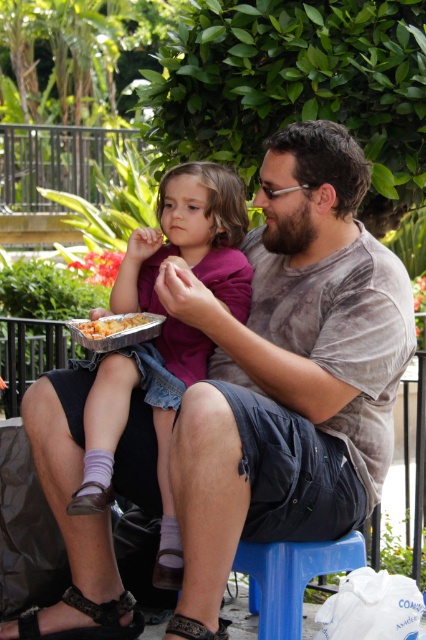
You are a photographer standing in the park. You want to take a photo of the purple matte shirt at center and the leather sandal at lower center. Can you fit both subjects in the frame if your camera has a 3.5 feet wide field of view?

The purple matte shirt at center and the leather sandal at lower center are 3.84 feet apart from each other. Since the distance between them exceeds the camera field of view of 3.5 feet, the photographer cannot fit both subjects in the frame.